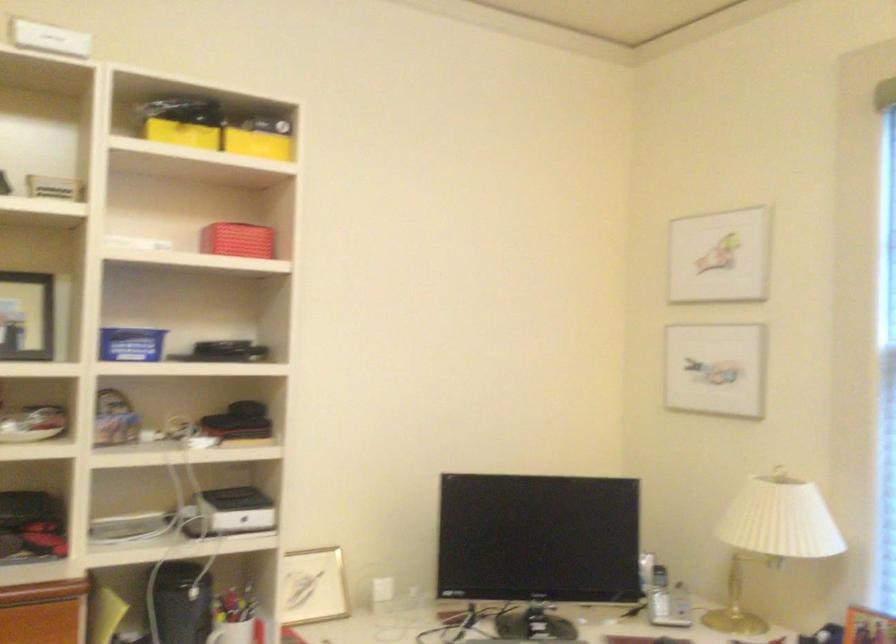
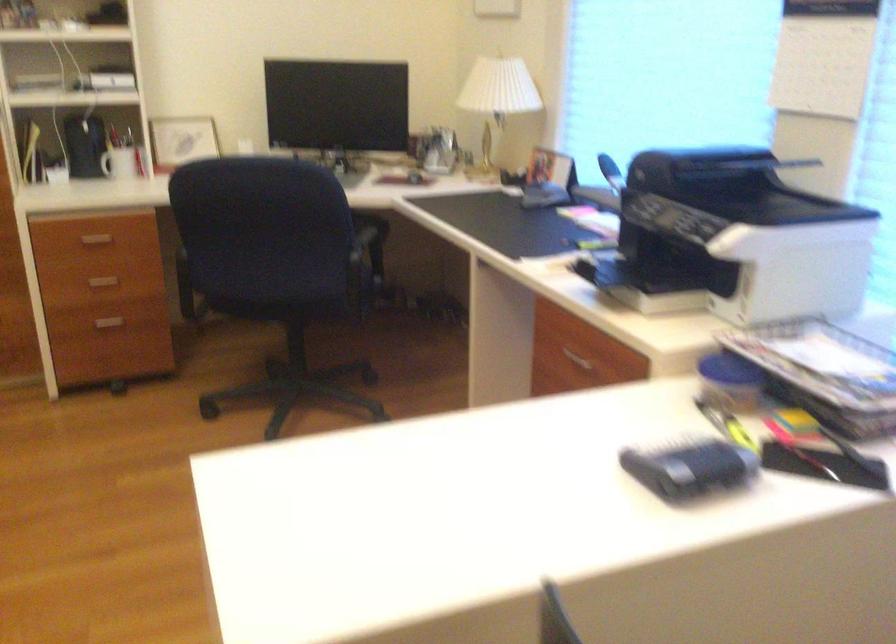
In a continuous first-person perspective shot, in which direction is the camera moving?

The cameraman walked toward right, backward.